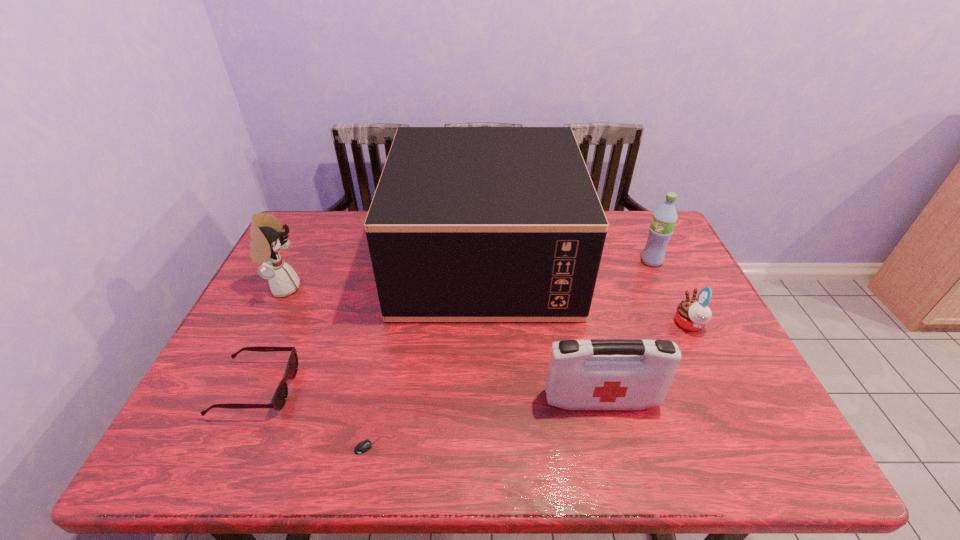
You are a GUI agent. You are given a task and a screenshot of the screen. Output one action in this format:
    pyautogui.click(x=<x>, y=<y>)
    Task: Click on the tallest object
    Image resolution: width=960 pixels, height=540 pixels.
    Given the screenshot: What is the action you would take?
    pyautogui.click(x=467, y=224)

At what (x,y) coordinates should I click in order to perform the action: click on doll. Please return your answer as a coordinate pair (x, y). The width and height of the screenshot is (960, 540). Looking at the image, I should click on (267, 236).

Locate an element on the screen. The image size is (960, 540). water bottle is located at coordinates pos(664,219).

Image resolution: width=960 pixels, height=540 pixels. Find the location of `the fourth shortest object`. the fourth shortest object is located at coordinates (611, 374).

You are a GUI agent. You are given a task and a screenshot of the screen. Output one action in this format:
    pyautogui.click(x=<x>, y=<y>)
    Task: Click on the third shortest object
    Image resolution: width=960 pixels, height=540 pixels.
    Given the screenshot: What is the action you would take?
    pyautogui.click(x=692, y=314)

Locate an element on the screen. The height and width of the screenshot is (540, 960). the second shortest object is located at coordinates (279, 398).

I want to click on the shortest object, so click(x=365, y=445).

This screenshot has height=540, width=960. Identify the location of mouse. (365, 445).

You are a GUI agent. You are given a task and a screenshot of the screen. Output one action in this format:
    pyautogui.click(x=<x>, y=<y>)
    Task: Click on the vacant point located 0.070m on the front-facing side of the box
    This screenshot has height=540, width=960.
    Given the screenshot: What is the action you would take?
    pyautogui.click(x=374, y=259)

What are the coordinates of `vacant space situated on the front-facing side of the box` in the screenshot? It's located at (348, 259).